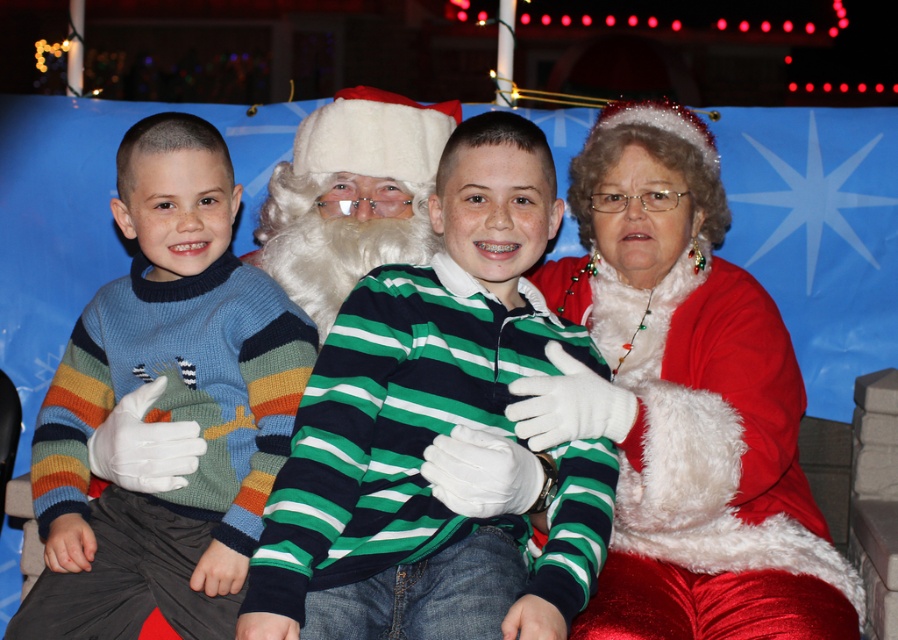
Question: Does green striped sweater at center appear on the left side of red velvet santa suit at right?

Choices:
 (A) yes
 (B) no

Answer: (A)

Question: Estimate the real-world distances between objects in this image. Which object is closer to the green striped sweater at center?

Choices:
 (A) red velvet santa suit at right
 (B) knitted sweater at left

Answer: (A)

Question: In this image, where is red velvet santa suit at right located relative to white fluffy beard at center?

Choices:
 (A) below
 (B) above

Answer: (A)

Question: Which point is farther to the camera?

Choices:
 (A) knitted sweater at left
 (B) red velvet santa suit at right
 (C) white fluffy beard at center
 (D) green striped sweater at center

Answer: (C)

Question: Is green striped sweater at center positioned behind red velvet santa suit at right?

Choices:
 (A) yes
 (B) no

Answer: (B)

Question: Estimate the real-world distances between objects in this image. Which object is closer to the green striped sweater at center?

Choices:
 (A) red velvet santa suit at right
 (B) knitted sweater at left

Answer: (A)